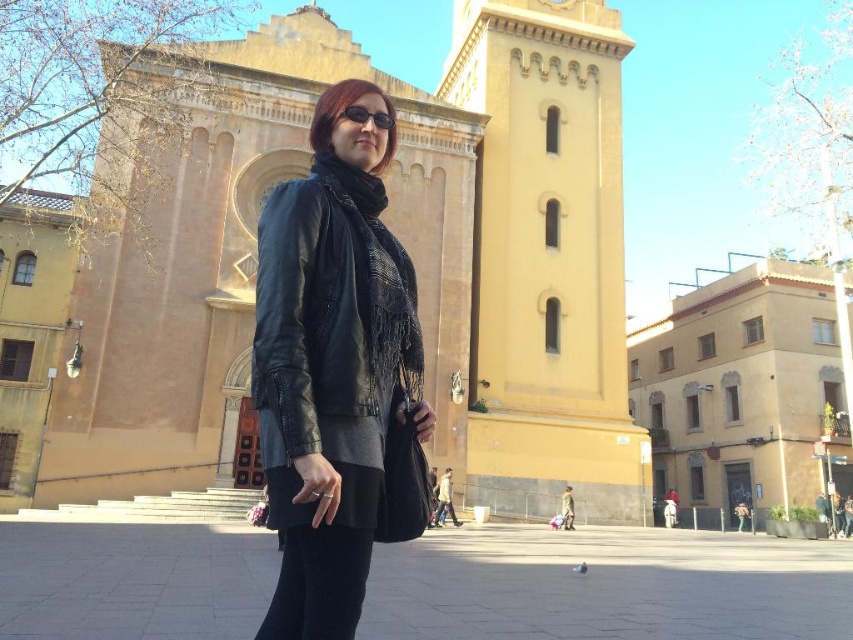
In the European town square scene, there is a woman wearing a matte black leather jacket at center and a yellow matte tower at center. Which object is positioned to the right of the other?

The yellow matte tower at center is to the right of the matte black leather jacket at center.

You are a photographer standing in the town square, and you want to take a photo that includes both the woman in the foreground and the tower of the building. Which of the two points, point [91,332] or point [555,36], is closer to you?

Point [91,332] is closer to the viewer than point [555,36].